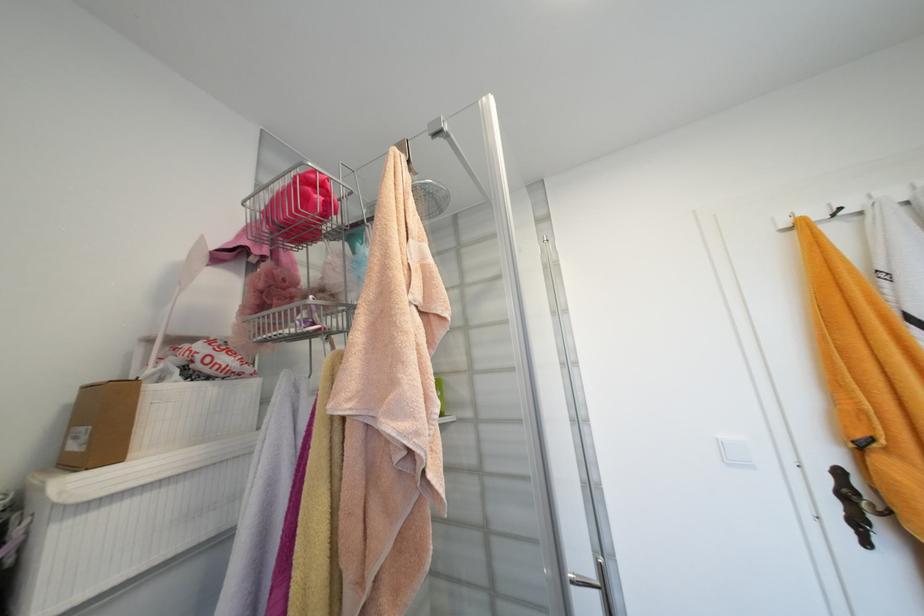
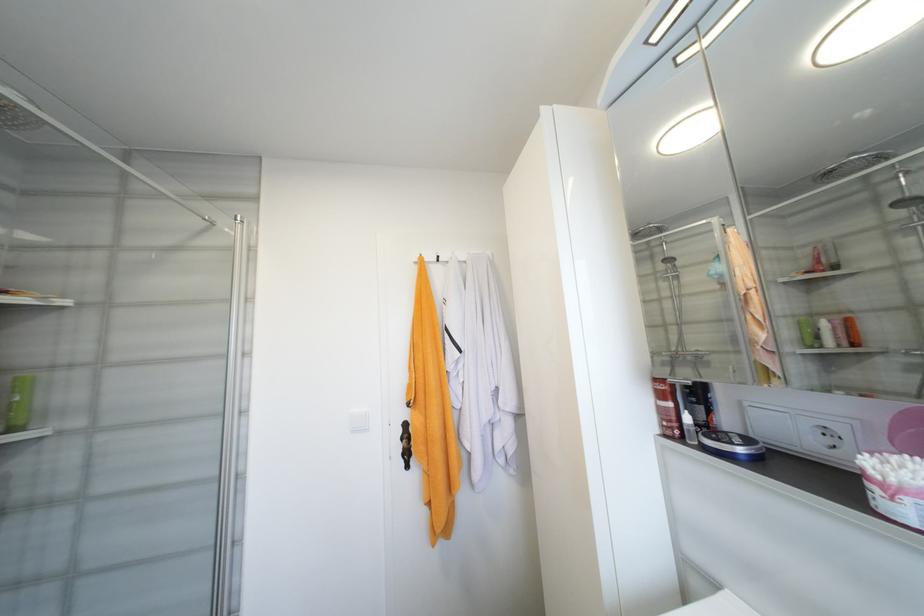
The point at [845,209] is marked in the first image. Where is the corresponding point in the second image?

(444, 257)